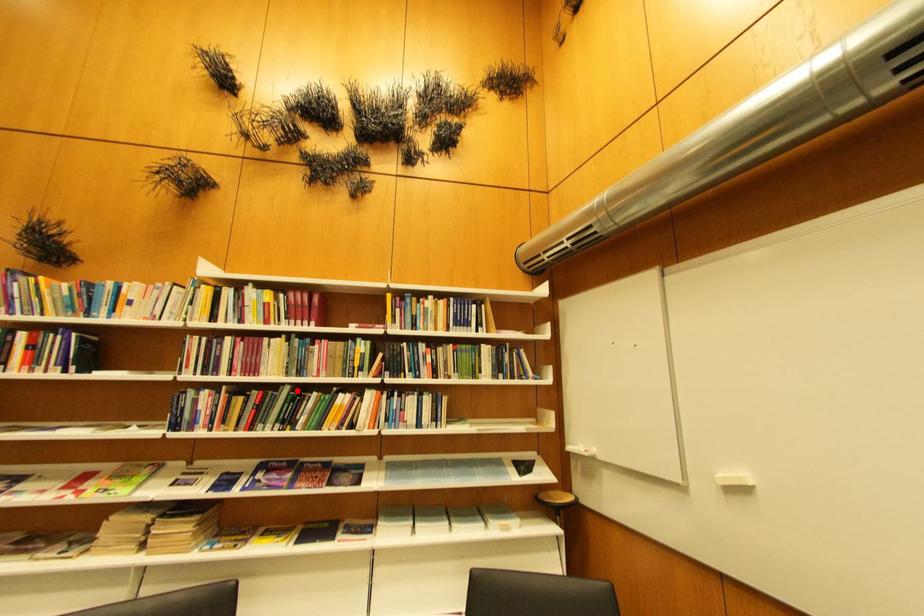
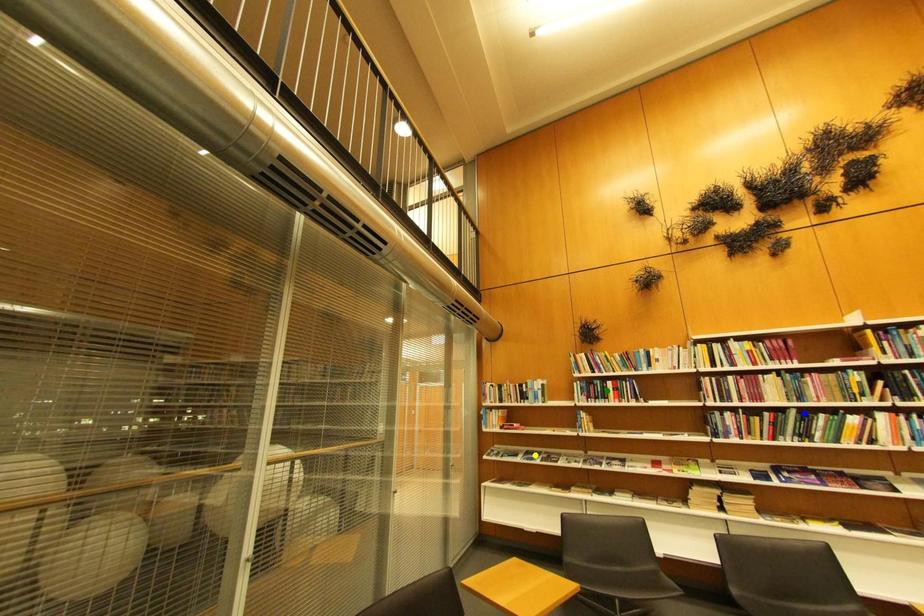
Question: I am providing you with two images of the same scene from different viewpoints. A red point is marked on the first image. You are given multiple points on the second image. Which point in image 2 is actually the same real-world point as the red point in image 1?

Choices:
 (A) blue point
 (B) green point
 (C) yellow point

Answer: (A)